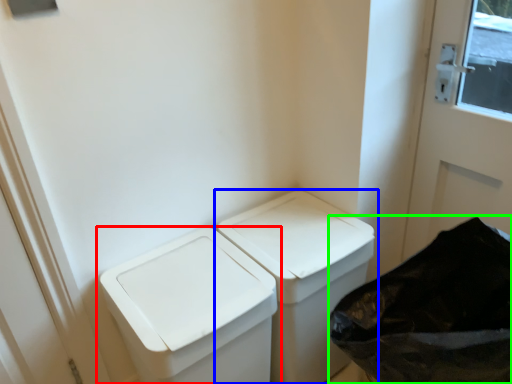
Question: Estimate the real-world distances between objects in this image. Which object is closer to waste container (highlighted by a red box), waste container (highlighted by a blue box) or recycling bin (highlighted by a green box)?

Choices:
 (A) waste container
 (B) recycling bin

Answer: (A)